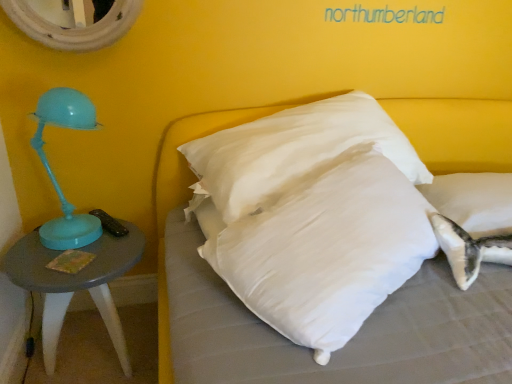
Question: Can you confirm if matte gray table at left is wider than white soft pillow at center?

Choices:
 (A) no
 (B) yes

Answer: (A)

Question: Is the position of matte gray table at left more distant than that of white soft pillow at center?

Choices:
 (A) yes
 (B) no

Answer: (A)

Question: From the image's perspective, is matte gray table at left above white soft pillow at center?

Choices:
 (A) no
 (B) yes

Answer: (A)

Question: Is matte gray table at left to the left of white soft pillow at center from the viewer's perspective?

Choices:
 (A) yes
 (B) no

Answer: (A)

Question: Is matte gray table at left smaller than white soft pillow at center?

Choices:
 (A) no
 (B) yes

Answer: (B)

Question: Is point (166, 332) positioned closer to the camera than point (130, 18)?

Choices:
 (A) farther
 (B) closer

Answer: (B)

Question: Which is correct: white soft pillow at center is inside white textured mirror at upper left, or outside of it?

Choices:
 (A) inside
 (B) outside

Answer: (B)

Question: Looking at the image, does white soft pillow at center seem bigger or smaller compared to white textured mirror at upper left?

Choices:
 (A) big
 (B) small

Answer: (A)

Question: From the image's perspective, is white soft pillow at center positioned above or below white textured mirror at upper left?

Choices:
 (A) below
 (B) above

Answer: (A)

Question: From the image's perspective, relative to white soft pillow at center, is matte gray table at left above or below?

Choices:
 (A) above
 (B) below

Answer: (B)

Question: From their relative heights in the image, would you say matte gray table at left is taller or shorter than white soft pillow at center?

Choices:
 (A) short
 (B) tall

Answer: (B)

Question: Is matte gray table at left inside or outside of white soft pillow at center?

Choices:
 (A) outside
 (B) inside

Answer: (A)

Question: Visually, is matte gray table at left positioned to the left or to the right of white soft pillow at center?

Choices:
 (A) right
 (B) left

Answer: (B)

Question: From the image's perspective, is white soft pillow at center located above or below white textured mirror at upper left?

Choices:
 (A) below
 (B) above

Answer: (A)

Question: Considering the positions of point (484, 221) and point (96, 29), is point (484, 221) closer or farther from the camera than point (96, 29)?

Choices:
 (A) closer
 (B) farther

Answer: (A)